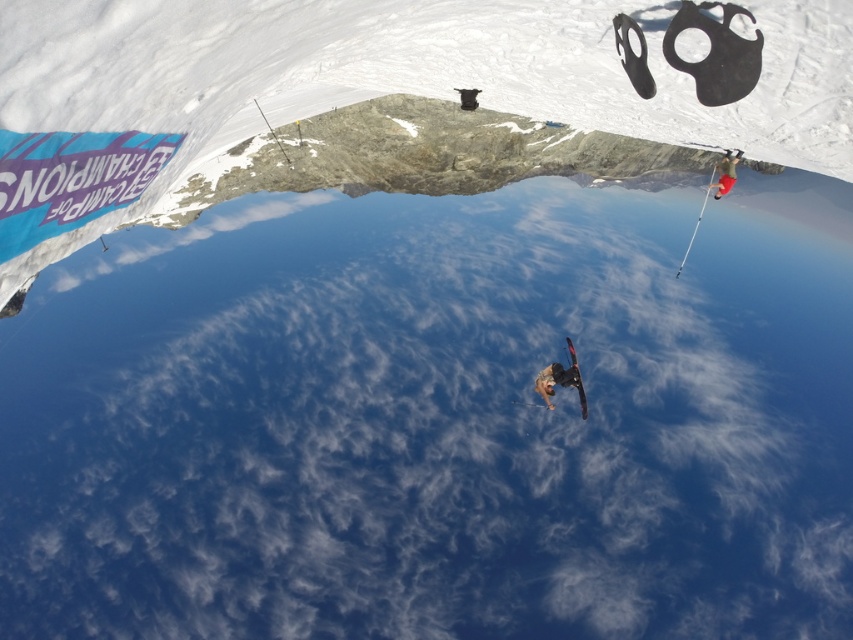
Is red fabric pants at right thinner than black matte parachute at center?

In fact, red fabric pants at right might be wider than black matte parachute at center.

Does point (738, 150) come farther from viewer compared to point (578, 387)?

That is False.

Which is behind, point (715, 168) or point (573, 356)?

Positioned behind is point (715, 168).

The height and width of the screenshot is (640, 853). What are the coordinates of `red fabric pants at right` in the screenshot? It's located at (724, 172).

Can you confirm if dark gray snowboarder at center is taller than red fabric pants at right?

No, dark gray snowboarder at center is not taller than red fabric pants at right.

Does point (538, 371) come in front of point (718, 164)?

No, it is not.

Find the location of a particular element. dark gray snowboarder at center is located at coordinates (555, 380).

Between dark gray snowboarder at center and black matte parachute at center, which one has more height?

dark gray snowboarder at center is taller.

Which is below, dark gray snowboarder at center or black matte parachute at center?

Positioned lower is dark gray snowboarder at center.

What are the coordinates of `dark gray snowboarder at center` in the screenshot? It's located at (555, 380).